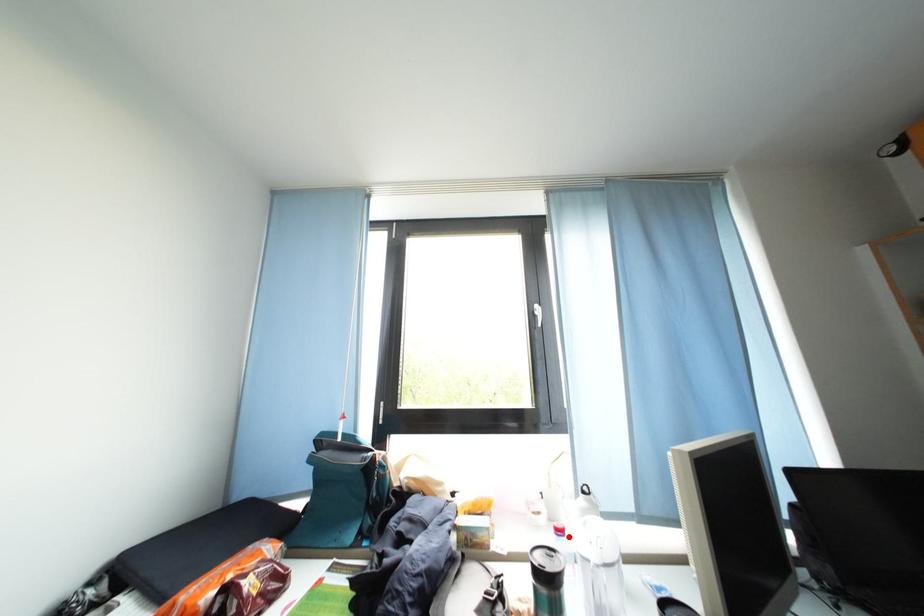
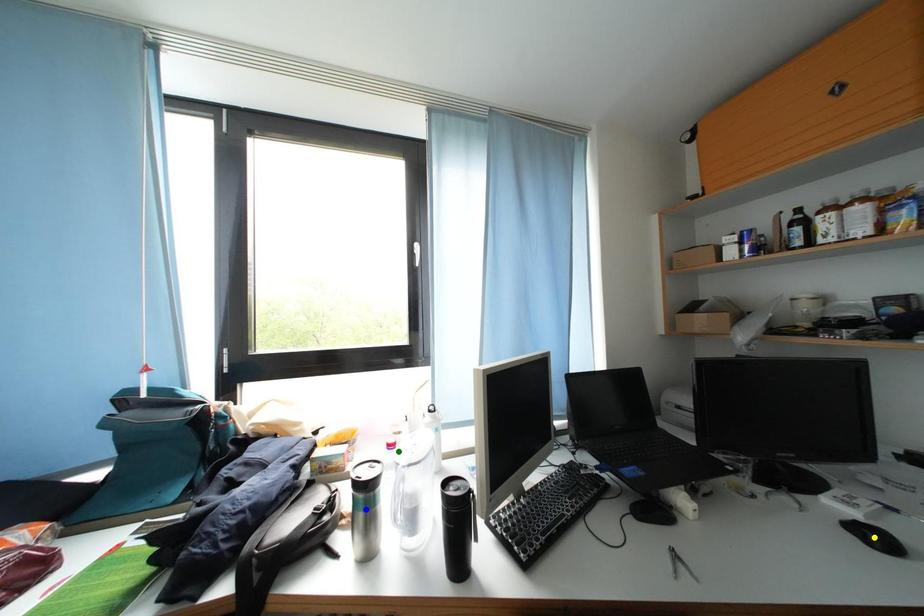
Question: I am providing you with two images of the same scene from different viewpoints. A red point is marked on the first image. You are given multiple points on the second image. Can you choose the point in image 2 that corresponds to the point in image 1?

Choices:
 (A) yellow point
 (B) green point
 (C) blue point

Answer: (B)